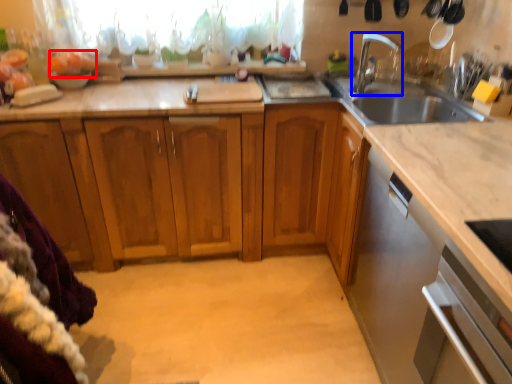
Question: Which point is further to the camera, food (highlighted by a red box) or tap (highlighted by a blue box)?

Choices:
 (A) food
 (B) tap

Answer: (A)